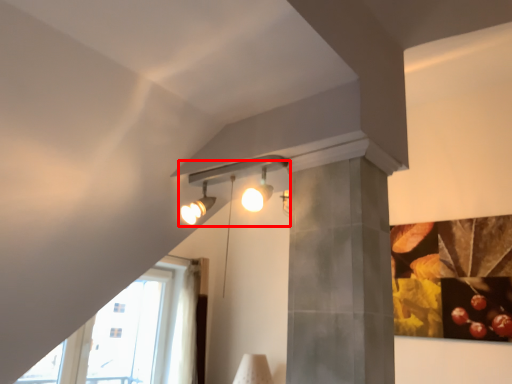
Question: Where is lamp (annotated by the red box) located in relation to glass door in the image?

Choices:
 (A) left
 (B) right

Answer: (B)